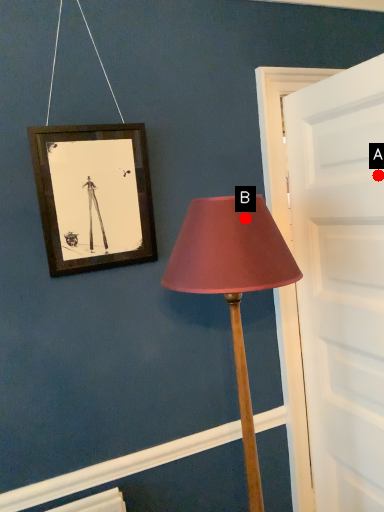
Question: Two points are circled on the image, labeled by A and B beside each circle. Which of the following is the farthest from the observer?

Choices:
 (A) A is further
 (B) B is further

Answer: (A)